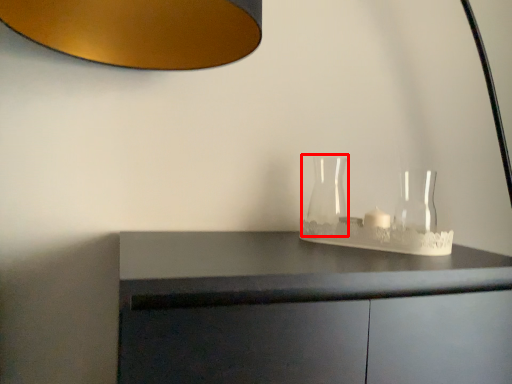
Question: In this image, where is glass vase (annotated by the red box) located relative to glass vase?

Choices:
 (A) left
 (B) right

Answer: (A)